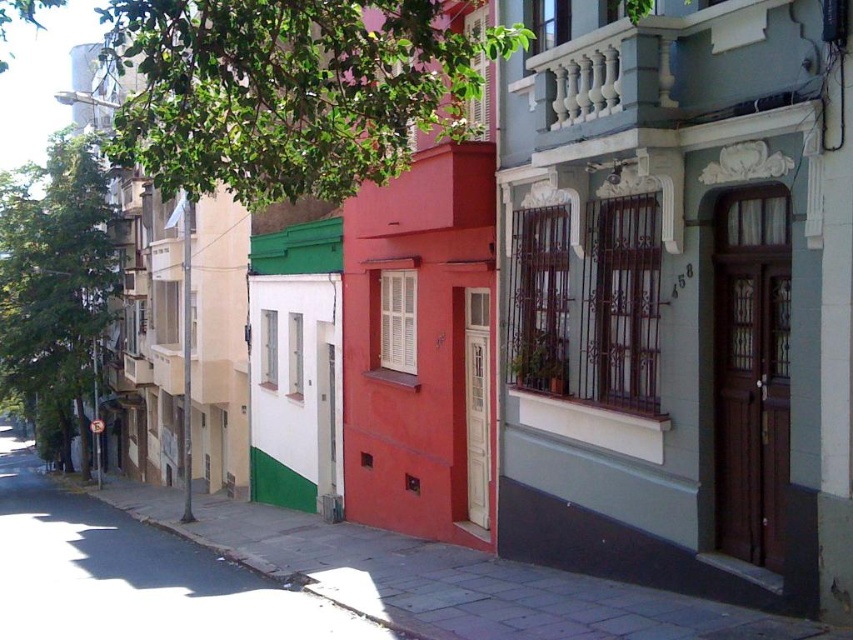
Does smooth concrete sidewalk at lower center lie behind green matte wall at center?

That is False.

Between smooth concrete sidewalk at lower center and green matte wall at center, which one has less height?

Standing shorter between the two is smooth concrete sidewalk at lower center.

Which is in front, point (142, 512) or point (177, 609)?

Point (177, 609)

You are a GUI agent. You are given a task and a screenshot of the screen. Output one action in this format:
    pyautogui.click(x=<x>, y=<y>)
    Task: Click on the smooth concrete sidewalk at lower center
    The height and width of the screenshot is (640, 853).
    Given the screenshot: What is the action you would take?
    click(447, 579)